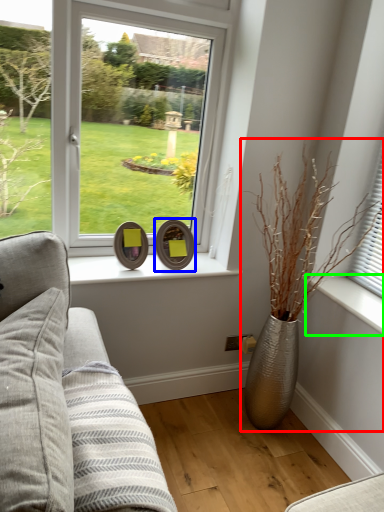
Question: Based on their relative distances, which object is nearer to houseplant (highlighted by a red box)? Choose from picture frame (highlighted by a blue box) and window sill (highlighted by a green box).

Choices:
 (A) picture frame
 (B) window sill

Answer: (B)